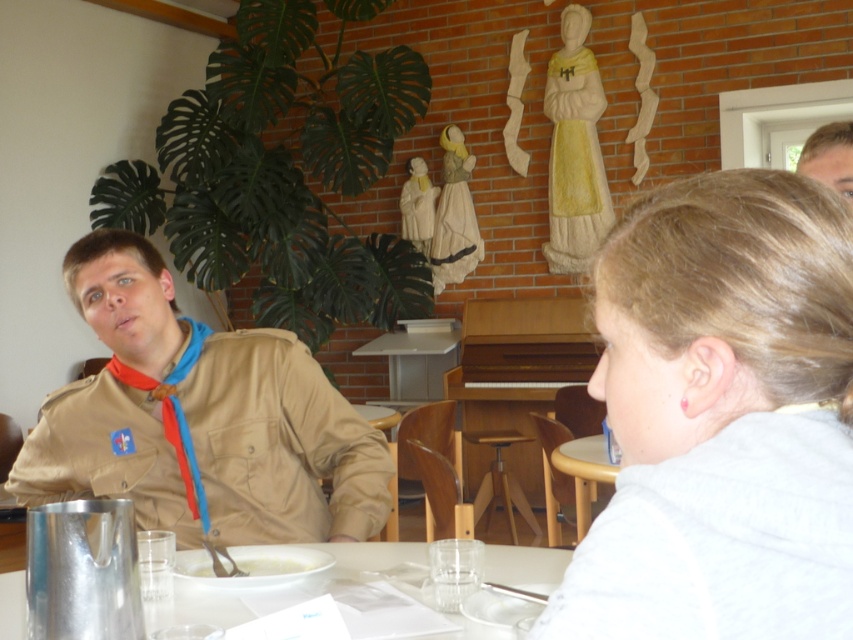
Is point (850, 230) positioned in front of point (289, 560)?

Yes.

Looking at this image, can you confirm if light brown hair at upper right is taller than white creamy soup at lower center?

Yes, light brown hair at upper right is taller than white creamy soup at lower center.

At what (x,y) coordinates should I click in order to perform the action: click on light brown hair at upper right. Please return your answer as a coordinate pair (x, y). The width and height of the screenshot is (853, 640). Looking at the image, I should click on (721, 417).

Locate an element on the screen. This screenshot has width=853, height=640. light brown hair at upper right is located at coordinates (721, 417).

This screenshot has width=853, height=640. What do you see at coordinates (198, 419) in the screenshot?
I see `tan uniform at center` at bounding box center [198, 419].

The width and height of the screenshot is (853, 640). What are the coordinates of `tan uniform at center` in the screenshot? It's located at (198, 419).

Locate an element on the screen. tan uniform at center is located at coordinates (198, 419).

Between light brown hair at upper right and red fabric lanyard at left, which one appears on the left side from the viewer's perspective?

red fabric lanyard at left

Does point (831, 451) come farther from viewer compared to point (206, 520)?

No, (831, 451) is in front of (206, 520).

Is point (790, 300) positioned after point (155, 387)?

No, (790, 300) is closer to viewer.

What are the coordinates of `light brown hair at upper right` in the screenshot? It's located at (721, 417).